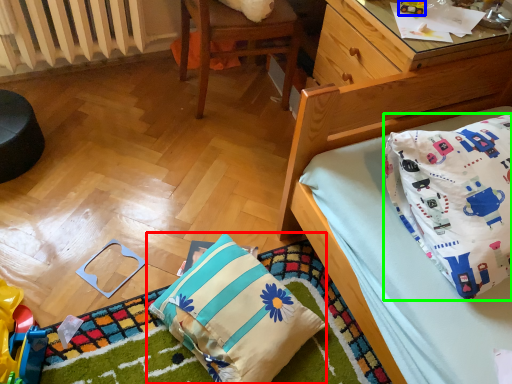
Question: Based on their relative distances, which object is nearer to pillow (highlighted by a red box)? Choose from toy (highlighted by a blue box) and pillow (highlighted by a green box).

Choices:
 (A) toy
 (B) pillow

Answer: (B)